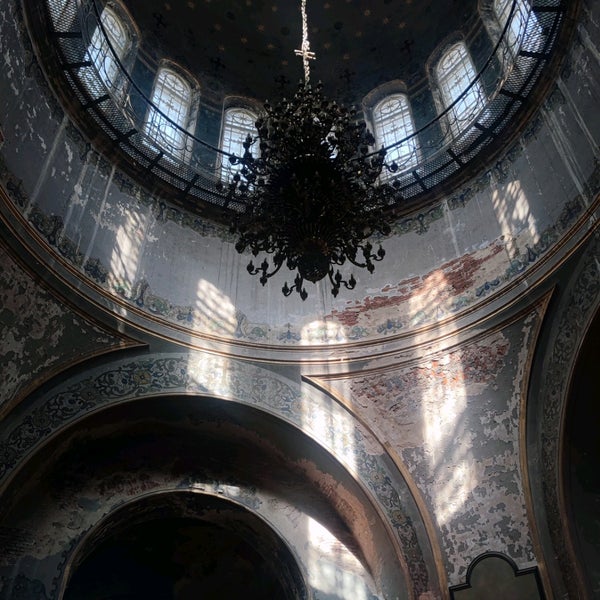
Image resolution: width=600 pixels, height=600 pixels. I want to click on windows, so click(x=398, y=124), click(x=237, y=128), click(x=233, y=140), click(x=175, y=107), click(x=110, y=74), click(x=461, y=99), click(x=516, y=23).